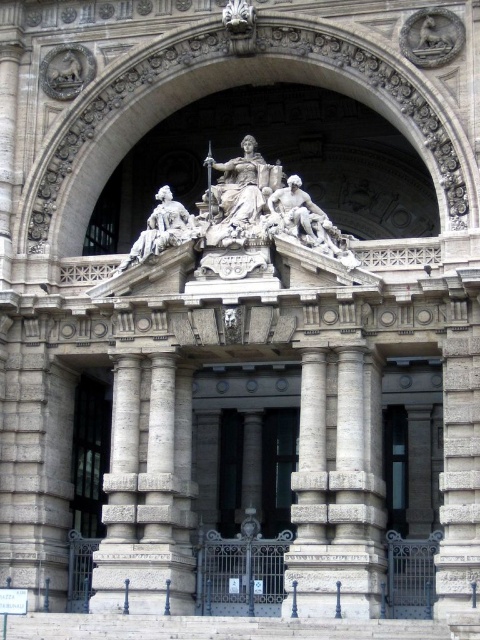
Question: Which point is farther to the camera?

Choices:
 (A) (144, 593)
 (B) (83, 588)
 (C) (364, 493)
 (D) (416, 144)

Answer: (B)

Question: Does light gray stone column at center have a lesser width compared to glass paneled door at center?

Choices:
 (A) no
 (B) yes

Answer: (A)

Question: Can you confirm if stone archway at center is positioned to the right of gray stone column at center?

Choices:
 (A) no
 (B) yes

Answer: (B)

Question: Which object is closer to the camera taking this photo?

Choices:
 (A) stone archway at center
 (B) light gray stone column at center

Answer: (B)

Question: Can you confirm if stone archway at center is positioned above light gray stone column at center?

Choices:
 (A) no
 (B) yes

Answer: (B)

Question: Which point is farther to the camera?

Choices:
 (A) (357, 445)
 (B) (398, 22)

Answer: (B)